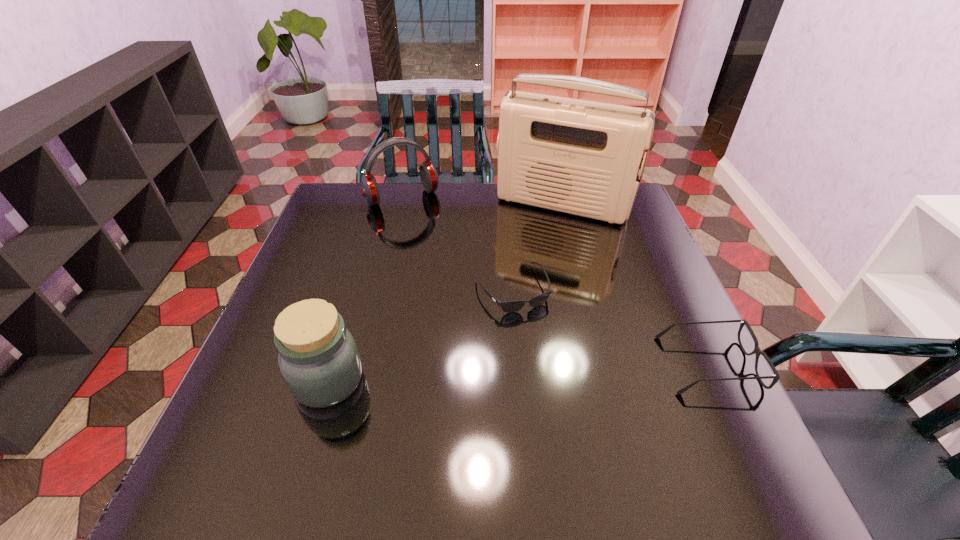
The width and height of the screenshot is (960, 540). Find the location of `vacant space at the near edge of the desktop`. vacant space at the near edge of the desktop is located at coordinates (329, 420).

Image resolution: width=960 pixels, height=540 pixels. Find the location of `free region at the left edge`. free region at the left edge is located at coordinates (333, 269).

Locate an element on the screen. vacant space at the right edge of the desktop is located at coordinates (599, 238).

Where is `free space at the far left corner`? Image resolution: width=960 pixels, height=540 pixels. free space at the far left corner is located at coordinates (332, 205).

Locate an element on the screen. free spot between the jar and the earphone is located at coordinates (365, 289).

At what (x,y) coordinates should I click in order to perform the action: click on free spot between the spectacles and the earphone. Please return your answer as a coordinate pair (x, y). The height and width of the screenshot is (540, 960). Looking at the image, I should click on (555, 281).

At what (x,y) coordinates should I click in order to perform the action: click on vacant space that is in between the second shortest object and the shortest object. Please return your answer as a coordinate pair (x, y). This screenshot has width=960, height=540. Looking at the image, I should click on (610, 327).

The width and height of the screenshot is (960, 540). Find the location of `free area in between the earphone and the jar`. free area in between the earphone and the jar is located at coordinates (365, 289).

Locate an element on the screen. empty space that is in between the jar and the earphone is located at coordinates (365, 289).

This screenshot has width=960, height=540. Identify the location of free space between the earphone and the jar. (365, 289).